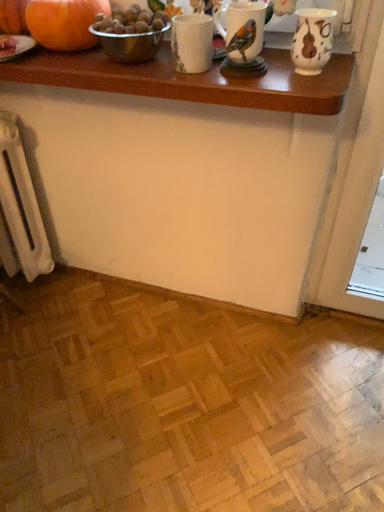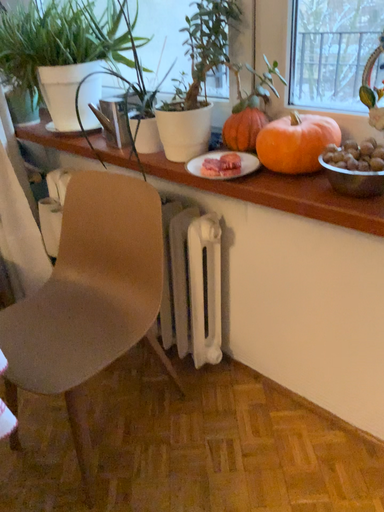
Question: Which way did the camera rotate in the video?

Choices:
 (A) rotated downward
 (B) rotated upward

Answer: (B)